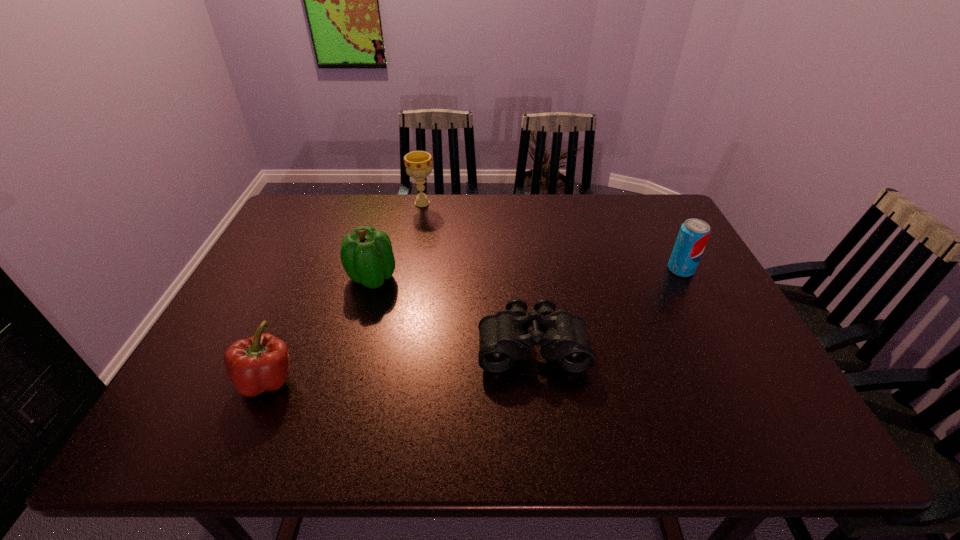
Image resolution: width=960 pixels, height=540 pixels. I want to click on vacant region between the farthest object and the soda can, so click(552, 237).

This screenshot has height=540, width=960. Find the location of `object identified as the closest to the binoculars`. object identified as the closest to the binoculars is located at coordinates (366, 255).

At what (x,y) coordinates should I click in order to perform the action: click on object that can be found as the second closest to the right bell pepper. Please return your answer as a coordinate pair (x, y). The width and height of the screenshot is (960, 540). Looking at the image, I should click on (503, 337).

This screenshot has width=960, height=540. I want to click on free space that satisfies the following two spatial constraints: 1. on the back side of the rightmost object; 2. on the right side of the farther bell pepper, so click(x=374, y=269).

At what (x,y) coordinates should I click in order to perform the action: click on free space that satisfies the following two spatial constraints: 1. on the back side of the right bell pepper; 2. on the left side of the left bell pepper. Please return your answer as a coordinate pair (x, y). Looking at the image, I should click on click(x=312, y=278).